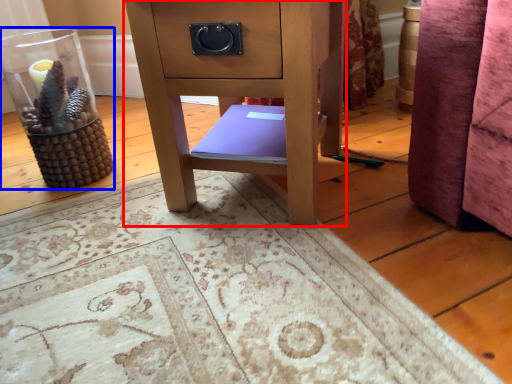
Question: Which point is closer to the camera, furniture (highlighted by a red box) or glass vase (highlighted by a blue box)?

Choices:
 (A) furniture
 (B) glass vase

Answer: (A)